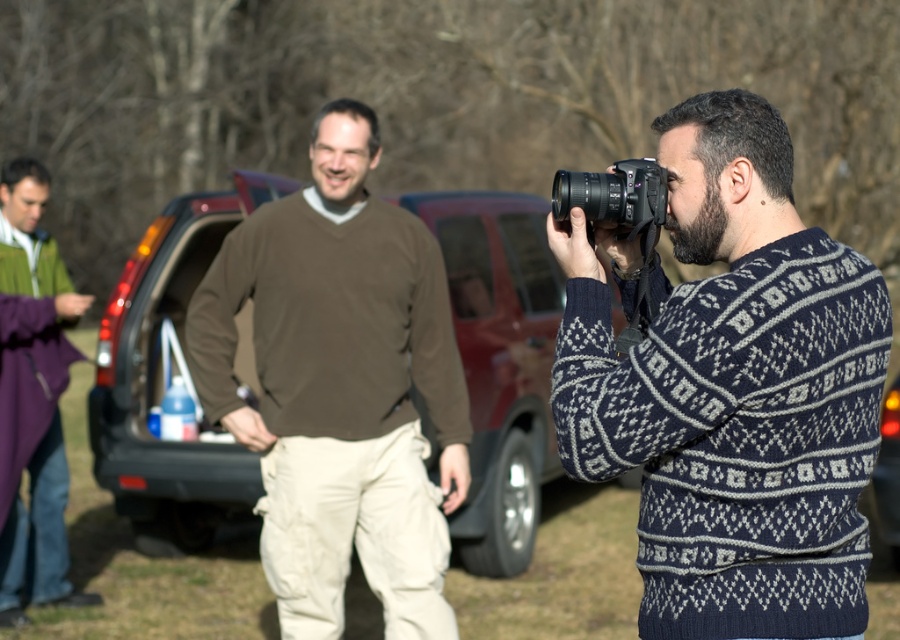
Question: Can you confirm if black plastic camera at center is positioned below metallic silver car at center?

Choices:
 (A) no
 (B) yes

Answer: (A)

Question: Which point appears closest to the camera in this image?

Choices:
 (A) (744, 548)
 (B) (237, 346)
 (C) (293, 236)
 (D) (572, 182)

Answer: (A)

Question: Is matte brown car at center to the left of metallic silver car at center from the viewer's perspective?

Choices:
 (A) yes
 (B) no

Answer: (A)

Question: Which object is the farthest from the brown cotton sweater at center?

Choices:
 (A) metallic silver car at center
 (B) navy blue sweater at center

Answer: (A)

Question: Which is farther from the metallic silver car at center?

Choices:
 (A) navy blue sweater at center
 (B) black plastic camera at center

Answer: (B)

Question: In this image, where is navy blue sweater at center located relative to brown cotton sweater at center?

Choices:
 (A) left
 (B) right

Answer: (B)